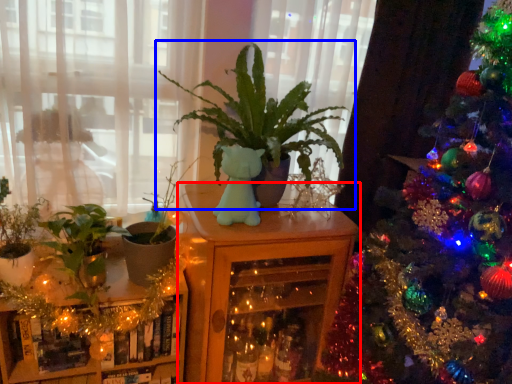
Question: Among these objects, which one is nearest to the camera, furniture (highlighted by a red box) or houseplant (highlighted by a blue box)?

Choices:
 (A) furniture
 (B) houseplant

Answer: (B)